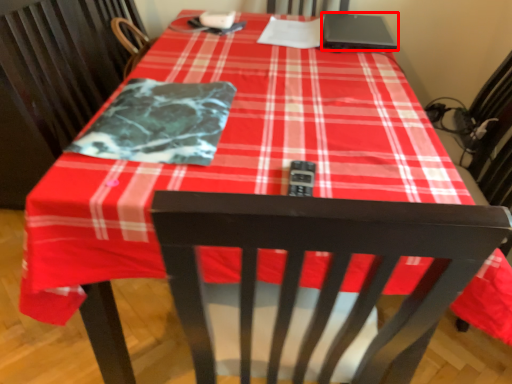
Question: In this image, where is laptop (annotated by the red box) located relative to blanket?

Choices:
 (A) right
 (B) left

Answer: (A)